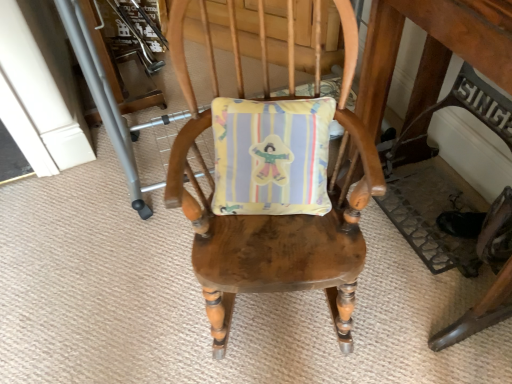
Question: Is wooden chair at center at the right side of wooden table at center?

Choices:
 (A) no
 (B) yes

Answer: (A)

Question: Does wooden chair at center have a greater width compared to wooden table at center?

Choices:
 (A) yes
 (B) no

Answer: (A)

Question: From the image's perspective, is wooden chair at center on top of wooden table at center?

Choices:
 (A) no
 (B) yes

Answer: (A)

Question: Is wooden chair at center positioned far away from wooden table at center?

Choices:
 (A) yes
 (B) no

Answer: (B)

Question: Does wooden chair at center lie behind wooden table at center?

Choices:
 (A) yes
 (B) no

Answer: (A)

Question: Considering the relative sizes of wooden chair at center and wooden table at center in the image provided, is wooden chair at center taller than wooden table at center?

Choices:
 (A) no
 (B) yes

Answer: (A)

Question: Is wooden table at center oriented towards wooden chair at center?

Choices:
 (A) yes
 (B) no

Answer: (A)

Question: Is wooden table at center beside wooden chair at center?

Choices:
 (A) yes
 (B) no

Answer: (B)

Question: Does wooden table at center come in front of wooden chair at center?

Choices:
 (A) yes
 (B) no

Answer: (A)

Question: From the image's perspective, does wooden table at center appear lower than wooden chair at center?

Choices:
 (A) no
 (B) yes

Answer: (A)

Question: Could wooden chair at center be considered to be inside wooden table at center?

Choices:
 (A) no
 (B) yes

Answer: (A)

Question: Is wooden table at center smaller than wooden chair at center?

Choices:
 (A) yes
 (B) no

Answer: (B)

Question: From a real-world perspective, relative to wooden chair at center, is wooden table at center vertically above or below?

Choices:
 (A) above
 (B) below

Answer: (A)